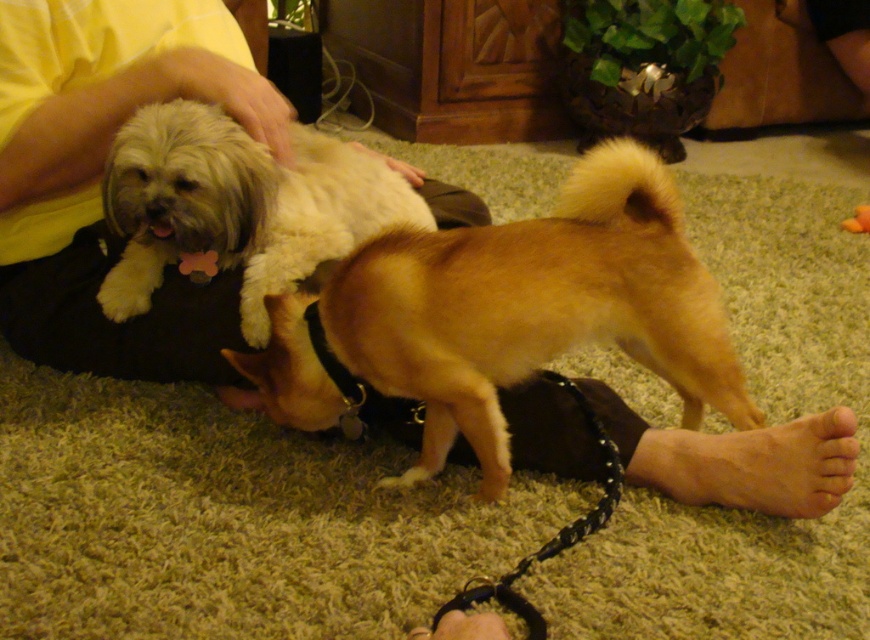
Question: Can you confirm if light brown fur at center is smaller than skinny barefoot at lower right?

Choices:
 (A) yes
 (B) no

Answer: (B)

Question: Which point is farther to the camera?

Choices:
 (A) (148, 298)
 (B) (845, 445)

Answer: (A)

Question: Considering the relative positions of light brown fur at center and skinny barefoot at lower right in the image provided, where is light brown fur at center located with respect to skinny barefoot at lower right?

Choices:
 (A) below
 (B) above

Answer: (B)

Question: Which object is closer to the camera taking this photo?

Choices:
 (A) skinny barefoot at lower right
 (B) light brown fur at center

Answer: (B)

Question: Does light brown fur at center have a lesser width compared to skinny barefoot at lower right?

Choices:
 (A) no
 (B) yes

Answer: (A)

Question: Which of the following is the farthest from the observer?

Choices:
 (A) (738, 458)
 (B) (550, 332)
 (C) (355, 196)

Answer: (C)